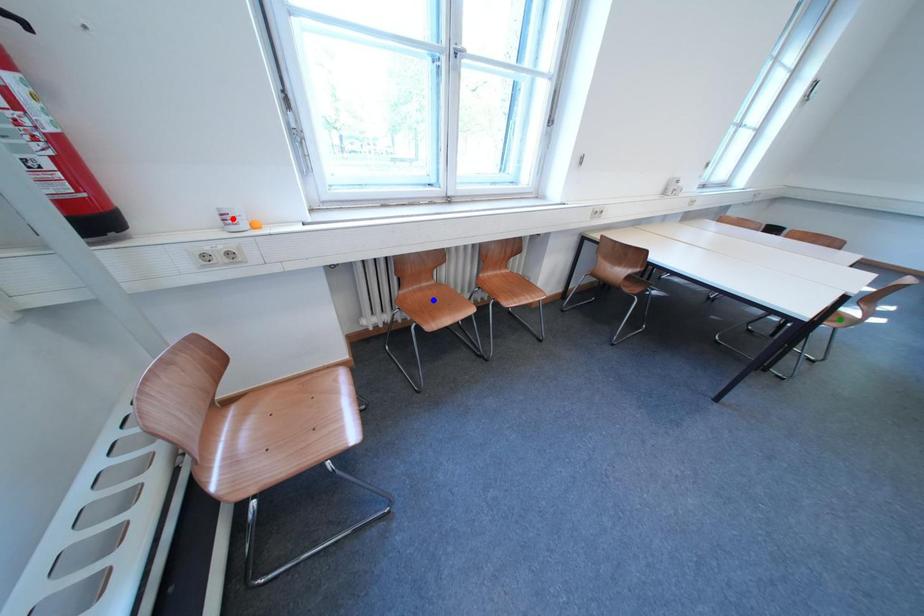
Order these from nearest to farthest:
green point | blue point | red point

red point, blue point, green point